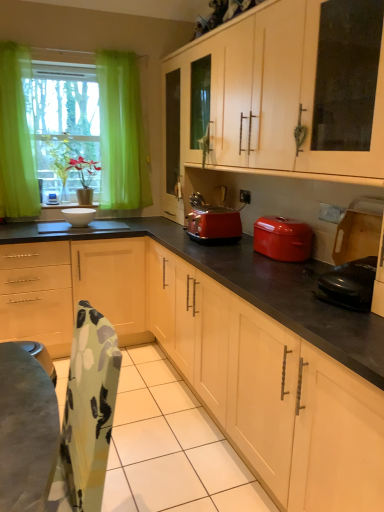
What are the coordinates of `space that is in front of shiny red toaster at center` in the screenshot? It's located at (209, 250).